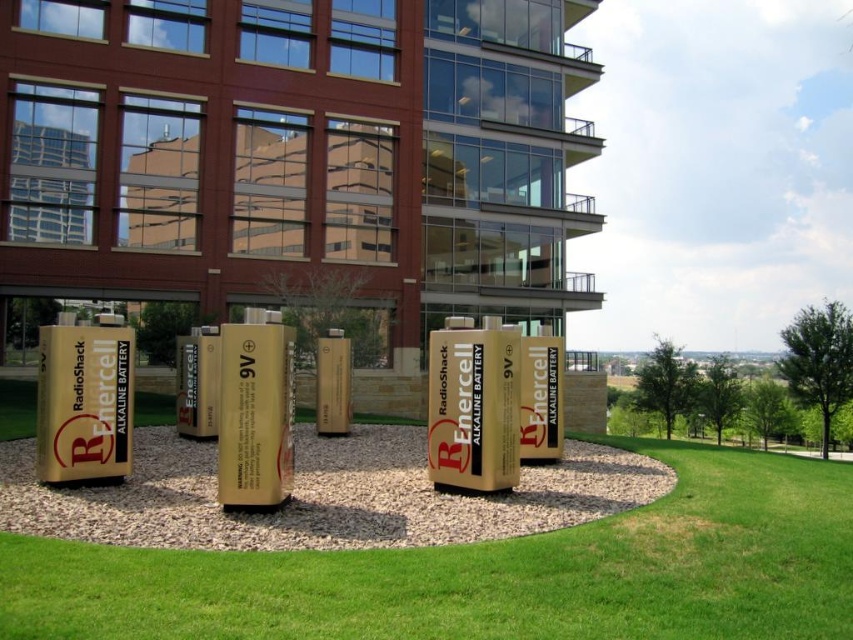
Question: Among these objects, which one is nearest to the camera?

Choices:
 (A) green grass at center
 (B) gold gravel at center

Answer: (A)

Question: Which object is closer to the camera taking this photo?

Choices:
 (A) green grass at center
 (B) gold gravel at center

Answer: (A)

Question: Is green grass at center smaller than gold gravel at center?

Choices:
 (A) no
 (B) yes

Answer: (A)

Question: Where is green grass at center located in relation to gold gravel at center in the image?

Choices:
 (A) below
 (B) above

Answer: (A)

Question: Which object is closer to the camera taking this photo?

Choices:
 (A) green grass at center
 (B) gold gravel at center

Answer: (A)

Question: Can you confirm if green grass at center is smaller than gold gravel at center?

Choices:
 (A) yes
 (B) no

Answer: (B)